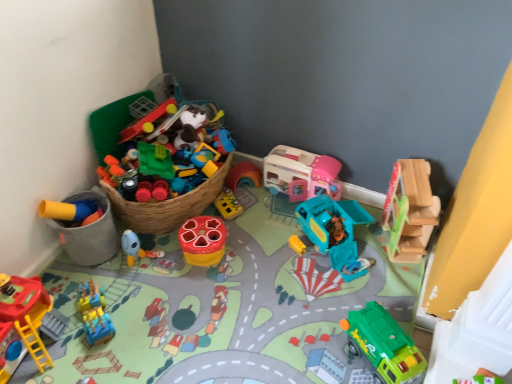
Measure the distance between blue rubber duck at center, which ranks as the sixth toy in right-to-left order, and camera.

blue rubber duck at center, which ranks as the sixth toy in right-to-left order, is 1.61 meters from camera.

Measure the distance between point (90, 288) and camera.

Point (90, 288) and camera are 5.04 feet apart from each other.

This screenshot has width=512, height=384. What do you see at coordinates (334, 231) in the screenshot?
I see `teal plastic truck at center, which ranks as the third toy in right-to-left order` at bounding box center [334, 231].

You are a GUI agent. You are given a task and a screenshot of the screen. Output one action in this format:
    pyautogui.click(x=<x>, y=<y>)
    Task: Click on the rubberized yellow toy at left, marked as the 1th toy in a left-to-right arrangement
    
    Given the screenshot: What is the action you would take?
    pyautogui.click(x=89, y=233)

Describe the element at coordinates (89, 233) in the screenshot. I see `rubberized yellow toy at left, which appears as the 8th toy when viewed from the right` at that location.

The width and height of the screenshot is (512, 384). I want to click on wooden slide at upper right, arranged as the first toy when viewed from the right, so click(410, 210).

Is wooden slide at upper right, arranged as the first toy when viewed from the right, outside of blue plastic train at lower left, acting as the seventh toy starting from the right?

Yes, wooden slide at upper right, arranged as the first toy when viewed from the right, is located beyond the bounds of blue plastic train at lower left, acting as the seventh toy starting from the right.

Considering the points (423, 234) and (99, 322), which point is in front, point (423, 234) or point (99, 322)?

The point (99, 322) is closer to the camera.

Is wooden slide at upper right, arranged as the first toy when viewed from the right, behind blue plastic train at lower left, placed as the second toy when sorted from left to right?

Yes.

From a real-world perspective, starting from the blue plastic train at lower left, placed as the second toy when sorted from left to right, which toy is the 7th one vertically above it? Please provide its 2D coordinates.

[(410, 210)]

Considering the points (403, 367) and (388, 226), which point is in front, point (403, 367) or point (388, 226)?

The point (403, 367) is closer.

Is green matte truck at lower right, which is the 7th toy from left to right, to the left of wooden slide at upper right, which is counted as the 8th toy, starting from the left, from the viewer's perspective?

Yes.

Is green matte truck at lower right, which is the 7th toy from left to right, looking in the opposite direction of wooden slide at upper right, which is counted as the 8th toy, starting from the left?

Yes, green matte truck at lower right, which is the 7th toy from left to right, is positioned with its back facing wooden slide at upper right, which is counted as the 8th toy, starting from the left.

I want to click on the 2nd toy behind the green matte truck at lower right, arranged as the second toy when viewed from the right, counting from the anchor's position, so click(410, 210).

Is pink plastic playhouse at upper right, acting as the fourth toy starting from the right, to the left of green matte truck at lower right, which is the 7th toy from left to right, from the viewer's perspective?

Correct, you'll find pink plastic playhouse at upper right, acting as the fourth toy starting from the right, to the left of green matte truck at lower right, which is the 7th toy from left to right.

Considering the relative sizes of pink plastic playhouse at upper right, acting as the fourth toy starting from the right, and green matte truck at lower right, which is the 7th toy from left to right, in the image provided, is pink plastic playhouse at upper right, acting as the fourth toy starting from the right, smaller than green matte truck at lower right, which is the 7th toy from left to right,?

No.

From a real-world perspective, which object rests below the other?

From a 3D spatial view, green matte truck at lower right, which is the 7th toy from left to right, is below.

Which point is more distant from viewer, (x=315, y=158) or (x=362, y=338)?

Positioned behind is point (x=315, y=158).

How many degrees apart are the facing directions of pink plastic playhouse at upper right, marked as the fifth toy in a left-to-right arrangement, and wooden slide at upper right, arranged as the first toy when viewed from the right?

There is a 16.9-degree angle between the facing directions of pink plastic playhouse at upper right, marked as the fifth toy in a left-to-right arrangement, and wooden slide at upper right, arranged as the first toy when viewed from the right.

Is pink plastic playhouse at upper right, acting as the fourth toy starting from the right, taller or shorter than wooden slide at upper right, arranged as the first toy when viewed from the right?

Considering their sizes, pink plastic playhouse at upper right, acting as the fourth toy starting from the right, has less height than wooden slide at upper right, arranged as the first toy when viewed from the right.

Is pink plastic playhouse at upper right, marked as the fifth toy in a left-to-right arrangement, positioned far away from wooden slide at upper right, arranged as the first toy when viewed from the right?

Actually, pink plastic playhouse at upper right, marked as the fifth toy in a left-to-right arrangement, and wooden slide at upper right, arranged as the first toy when viewed from the right, are a little close together.

Does point (331, 181) come behind point (395, 217)?

Yes, point (331, 181) is behind point (395, 217).

Considering their positions, is blue rubber duck at center, which ranks as the sixth toy in right-to-left order, located in front of or behind teal plastic truck at center, which ranks as the third toy in right-to-left order?

Visually, blue rubber duck at center, which ranks as the sixth toy in right-to-left order, is located behind teal plastic truck at center, which ranks as the third toy in right-to-left order.

Consider the image. How many degrees apart are the facing directions of blue rubber duck at center, which ranks as the sixth toy in right-to-left order, and teal plastic truck at center, which ranks as the third toy in right-to-left order?

The angular difference between blue rubber duck at center, which ranks as the sixth toy in right-to-left order, and teal plastic truck at center, which ranks as the third toy in right-to-left order, is 139 degrees.

Does blue rubber duck at center, which is the 3th toy in left-to-right order, have a lesser width compared to teal plastic truck at center, which is the 6th toy in left-to-right order?

Indeed, blue rubber duck at center, which is the 3th toy in left-to-right order, has a lesser width compared to teal plastic truck at center, which is the 6th toy in left-to-right order.

Is blue rubber duck at center, which ranks as the sixth toy in right-to-left order, shorter than teal plastic truck at center, which ranks as the third toy in right-to-left order?

No, blue rubber duck at center, which ranks as the sixth toy in right-to-left order, is not shorter than teal plastic truck at center, which ranks as the third toy in right-to-left order.

From a real-world perspective, is rubberized plastic toy at center, which is counted as the 5th toy, starting from the right, on top of green matte truck at lower right, which is the 7th toy from left to right?

No, from a real-world perspective, rubberized plastic toy at center, which is counted as the 5th toy, starting from the right, is not over green matte truck at lower right, which is the 7th toy from left to right

Based on the photo, could green matte truck at lower right, which is the 7th toy from left to right, be considered to be inside rubberized plastic toy at center, positioned as the fourth toy in left-to-right order?

No, green matte truck at lower right, which is the 7th toy from left to right, is not surrounded by rubberized plastic toy at center, positioned as the fourth toy in left-to-right order.

Can you see rubberized plastic toy at center, which is counted as the 5th toy, starting from the right, touching green matte truck at lower right, which is the 7th toy from left to right?

No, rubberized plastic toy at center, which is counted as the 5th toy, starting from the right, is not next to green matte truck at lower right, which is the 7th toy from left to right.

Consider the image. Can you confirm if rubberized plastic toy at center, positioned as the fourth toy in left-to-right order, is bigger than green matte truck at lower right, arranged as the second toy when viewed from the right?

Actually, rubberized plastic toy at center, positioned as the fourth toy in left-to-right order, might be smaller than green matte truck at lower right, arranged as the second toy when viewed from the right.

Could you measure the distance between wooden slide at upper right, arranged as the first toy when viewed from the right, and rubberized yellow toy at left, marked as the 1th toy in a left-to-right arrangement?

wooden slide at upper right, arranged as the first toy when viewed from the right, is 3.74 feet from rubberized yellow toy at left, marked as the 1th toy in a left-to-right arrangement.

From a real-world perspective, which toy is the 2nd one underneath the wooden slide at upper right, which is counted as the 8th toy, starting from the left? Please provide its 2D coordinates.

[(89, 233)]

Which is behind, wooden slide at upper right, which is counted as the 8th toy, starting from the left, or rubberized yellow toy at left, marked as the 1th toy in a left-to-right arrangement?

Positioned behind is rubberized yellow toy at left, marked as the 1th toy in a left-to-right arrangement.

Is wooden slide at upper right, arranged as the first toy when viewed from the right, not close to rubberized yellow toy at left, which appears as the 8th toy when viewed from the right?

wooden slide at upper right, arranged as the first toy when viewed from the right, is far away from rubberized yellow toy at left, which appears as the 8th toy when viewed from the right.

Identify the location of the 5th toy positioned above the blue plastic train at lower left, acting as the seventh toy starting from the right (from the image's perspective). This screenshot has height=384, width=512. (410, 210).

Locate an element on the screen. The height and width of the screenshot is (384, 512). the 6th toy below when counting from the wooden slide at upper right, arranged as the first toy when viewed from the right (from the image's perspective) is located at coordinates (384, 345).

Considering their positions, is rubberized plastic toy at center, which is counted as the 5th toy, starting from the right, positioned closer to blue rubber duck at center, which is the 3th toy in left-to-right order, than rubberized yellow toy at left, which appears as the 8th toy when viewed from the right?

The object closer to blue rubber duck at center, which is the 3th toy in left-to-right order, is rubberized yellow toy at left, which appears as the 8th toy when viewed from the right.

When comparing their distances from rubberized yellow toy at left, marked as the 1th toy in a left-to-right arrangement, does blue rubber duck at center, which is the 3th toy in left-to-right order, or green matte truck at lower right, which is the 7th toy from left to right, seem closer?

The object closer to rubberized yellow toy at left, marked as the 1th toy in a left-to-right arrangement, is blue rubber duck at center, which is the 3th toy in left-to-right order.

Estimate the real-world distances between objects in this image. Which object is closer to teal plastic truck at center, which is the 6th toy in left-to-right order, blue plastic train at lower left, placed as the second toy when sorted from left to right, or rubberized plastic toy at center, positioned as the fourth toy in left-to-right order?

rubberized plastic toy at center, positioned as the fourth toy in left-to-right order.

From the image, which object appears to be farther from blue plastic train at lower left, acting as the seventh toy starting from the right, rubberized yellow toy at left, which appears as the 8th toy when viewed from the right, or teal plastic truck at center, which ranks as the third toy in right-to-left order?

teal plastic truck at center, which ranks as the third toy in right-to-left order, is positioned further to the anchor blue plastic train at lower left, acting as the seventh toy starting from the right.

From the picture: When comparing their distances from blue rubber duck at center, which is the 3th toy in left-to-right order, does blue plastic train at lower left, placed as the second toy when sorted from left to right, or wooden slide at upper right, which is counted as the 8th toy, starting from the left, seem further?

wooden slide at upper right, which is counted as the 8th toy, starting from the left, is further to blue rubber duck at center, which is the 3th toy in left-to-right order.

Estimate the real-world distances between objects in this image. Which object is further from pink plastic playhouse at upper right, acting as the fourth toy starting from the right, rubberized yellow toy at left, marked as the 1th toy in a left-to-right arrangement, or blue plastic train at lower left, acting as the seventh toy starting from the right?

blue plastic train at lower left, acting as the seventh toy starting from the right, lies further to pink plastic playhouse at upper right, acting as the fourth toy starting from the right, than the other object.

From the image, which object appears to be nearer to rubberized plastic toy at center, which is counted as the 5th toy, starting from the right, blue rubber duck at center, which is the 3th toy in left-to-right order, or pink plastic playhouse at upper right, acting as the fourth toy starting from the right?

blue rubber duck at center, which is the 3th toy in left-to-right order, is positioned closer to the anchor rubberized plastic toy at center, which is counted as the 5th toy, starting from the right.

Looking at the image, which one is located closer to rubberized plastic toy at center, positioned as the fourth toy in left-to-right order, wooden slide at upper right, arranged as the first toy when viewed from the right, or teal plastic truck at center, which ranks as the third toy in right-to-left order?

teal plastic truck at center, which ranks as the third toy in right-to-left order, is closer to rubberized plastic toy at center, positioned as the fourth toy in left-to-right order.

Where is `toy situated between blue plastic train at lower left, acting as the seventh toy starting from the right, and rubberized plastic toy at center, positioned as the fourth toy in left-to-right order, from left to right`? The height and width of the screenshot is (384, 512). toy situated between blue plastic train at lower left, acting as the seventh toy starting from the right, and rubberized plastic toy at center, positioned as the fourth toy in left-to-right order, from left to right is located at coordinates (136, 248).

This screenshot has height=384, width=512. I want to click on toy between blue rubber duck at center, which is the 3th toy in left-to-right order, and pink plastic playhouse at upper right, marked as the fifth toy in a left-to-right arrangement, so click(x=203, y=240).

Identify the location of toy situated between rubberized plastic toy at center, which is counted as the 5th toy, starting from the right, and teal plastic truck at center, which is the 6th toy in left-to-right order, from left to right. (301, 174).